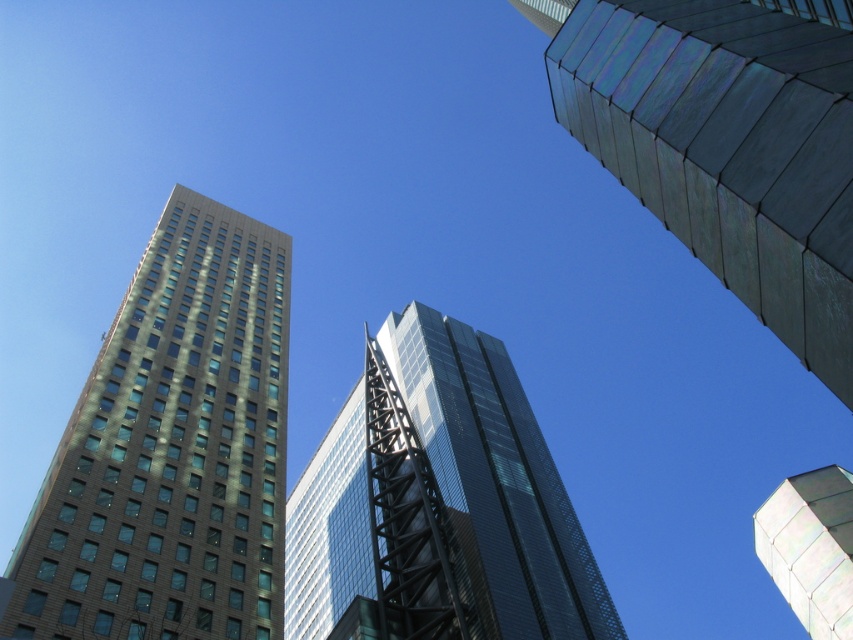
You are a drone operator trying to fly a drone from the glassy reflective skyscraper at center to the metallic silver tower at upper right. According to the image, can the drone fly directly between them without any obstruction?

The metallic silver tower at upper right is behind the glassy reflective skyscraper at center, so the drone cannot fly directly between them without passing through or around the glassy reflective skyscraper at center.

You are standing at the base of the tall beige building on the left and want to look up to the glassy reflective skyscraper at center. In which direction should you turn your head to see it?

The glassy reflective skyscraper at center is located at point (496,483), so you should turn your head to the right to see it since it is positioned to the right of the beige building on the left.

You are standing at the base of the brown brick building at left and want to walk to the glassy reflective skyscraper at center. Which direction should you head towards?

You should head towards the center because the glassy reflective skyscraper at center is located in that direction from the brown brick building at left.